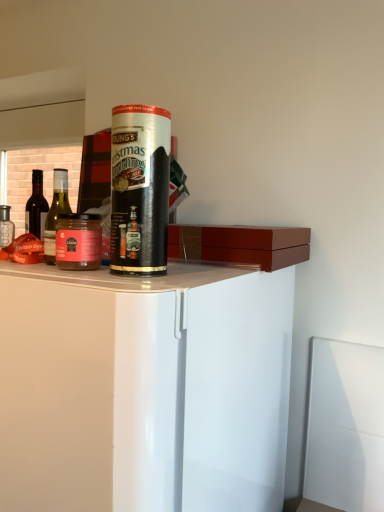
Question: From a real-world perspective, is green glass bottle at left, acting as the 1th bottle starting from the front, positioned above or below matte glass bottle at left, which is the 1th bottle from back to front?

Choices:
 (A) above
 (B) below

Answer: (B)

Question: Which is correct: green glass bottle at left, which is the 2th bottle from left to right, is inside matte glass bottle at left, which is the 1th bottle from back to front, or outside of it?

Choices:
 (A) inside
 (B) outside

Answer: (B)

Question: Which object is positioned closest to the matte glass bottle at left, the 2th bottle when ordered from right to left?

Choices:
 (A) matte glass jar at left
 (B) white glossy cabinet at center
 (C) transparent plastic straw at center
 (D) green glass bottle at left, which is the second bottle in back-to-front order

Answer: (A)

Question: Which object is positioned closest to the matte glass jar at left?

Choices:
 (A) green glass bottle at left, which is the second bottle in back-to-front order
 (B) transparent plastic straw at center
 (C) white glossy cabinet at center
 (D) matte glass bottle at left, the 2th bottle from the front

Answer: (B)